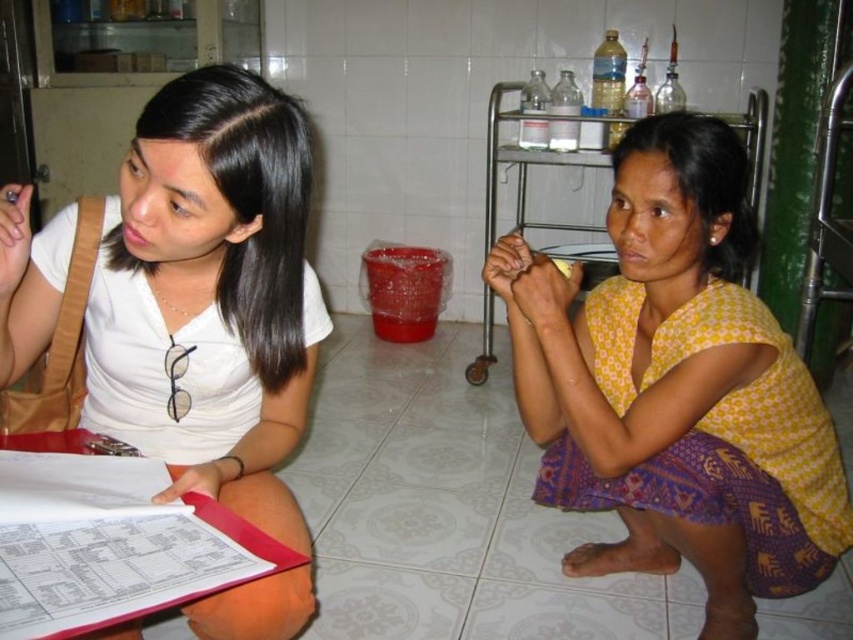
Question: Which of these objects is positioned closest to the pink plastic clipboard at lower left?

Choices:
 (A) white matte shirt at upper left
 (B) yellow printed fabric skirt at lower right

Answer: (A)

Question: Which object is closer to the camera taking this photo?

Choices:
 (A) white matte shirt at upper left
 (B) yellow printed fabric skirt at lower right
 (C) pink plastic clipboard at lower left

Answer: (C)

Question: Considering the relative positions of yellow printed fabric skirt at lower right and pink plastic clipboard at lower left in the image provided, where is yellow printed fabric skirt at lower right located with respect to pink plastic clipboard at lower left?

Choices:
 (A) right
 (B) left

Answer: (A)

Question: Which of the following is the farthest from the observer?

Choices:
 (A) pink plastic clipboard at lower left
 (B) white matte shirt at upper left
 (C) yellow printed fabric skirt at lower right

Answer: (C)

Question: Does yellow printed fabric skirt at lower right have a greater width compared to pink plastic clipboard at lower left?

Choices:
 (A) no
 (B) yes

Answer: (B)

Question: Is yellow printed fabric skirt at lower right closer to the viewer compared to white matte shirt at upper left?

Choices:
 (A) no
 (B) yes

Answer: (A)